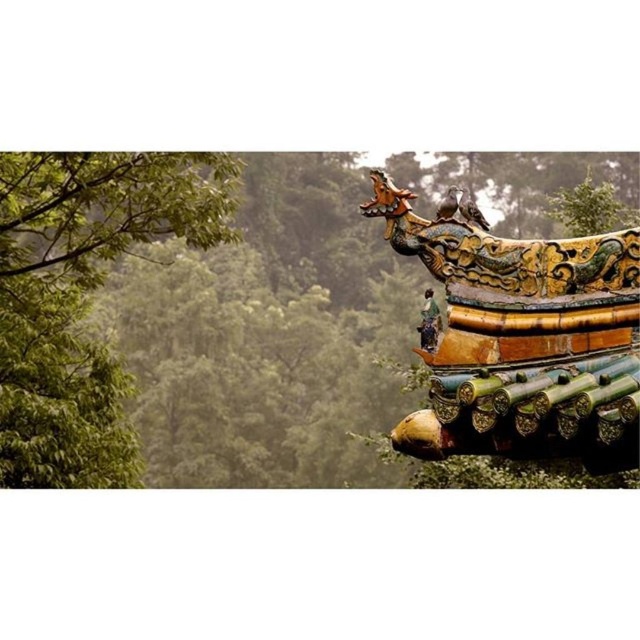
You are an architect examining the traditional East Asian roof structure. You notice the green leafy tree at upper left and the dragon figure at the roof apex. Based on their positions, which object is closer to the top edge of the image?

The green leafy tree at upper left is located at point (177, 352), which is closer to the top edge of the image compared to the dragon figure at the roof apex, so the green leafy tree at upper left is closer to the top edge.